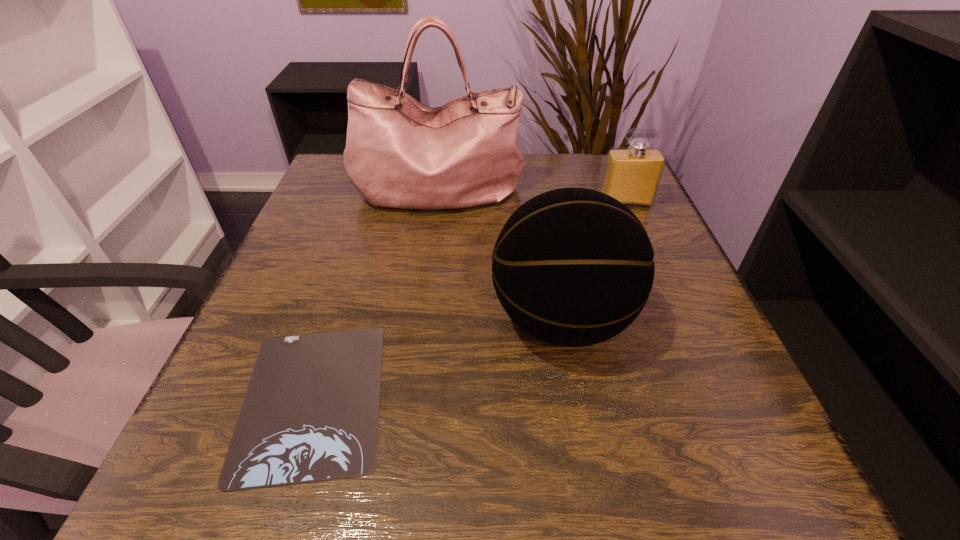
You are a GUI agent. You are given a task and a screenshot of the screen. Output one action in this format:
    pyautogui.click(x=<x>, y=<y>)
    Task: Click on the handbag
    This screenshot has width=960, height=540.
    Given the screenshot: What is the action you would take?
    pyautogui.click(x=400, y=153)

You are a GUI agent. You are given a task and a screenshot of the screen. Output one action in this format:
    pyautogui.click(x=<x>, y=<y>)
    Task: Click on the second tallest object
    The image size is (960, 540).
    Given the screenshot: What is the action you would take?
    pyautogui.click(x=573, y=267)

This screenshot has height=540, width=960. I want to click on the rightmost object, so click(x=632, y=175).

Find the location of `perfume`. perfume is located at coordinates (632, 175).

Image resolution: width=960 pixels, height=540 pixels. What are the coordinates of `the shortest object` in the screenshot? It's located at (310, 413).

At what (x,y) coordinates should I click in order to perform the action: click on vacant area situated at the front of the tallest object with handles. Please return your answer as a coordinate pair (x, y). The height and width of the screenshot is (540, 960). Looking at the image, I should click on (420, 327).

Where is `vacant space located 0.150m on the front of the second tallest object`? vacant space located 0.150m on the front of the second tallest object is located at coordinates (589, 480).

In order to click on blank space located on the front-facing side of the perfume in this screenshot , I will do `click(644, 247)`.

The image size is (960, 540). What are the coordinates of `free space located 0.380m on the right of the mousepad` in the screenshot? It's located at (646, 398).

Where is `handbag that is at the far edge`? The image size is (960, 540). handbag that is at the far edge is located at coordinates (400, 153).